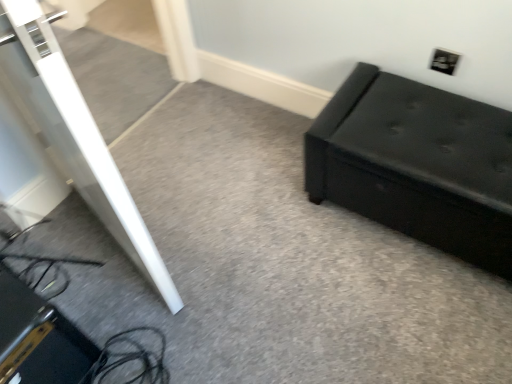
What are the coordinates of `vacant area to the left of black leather ottoman at right` in the screenshot? It's located at point(267,237).